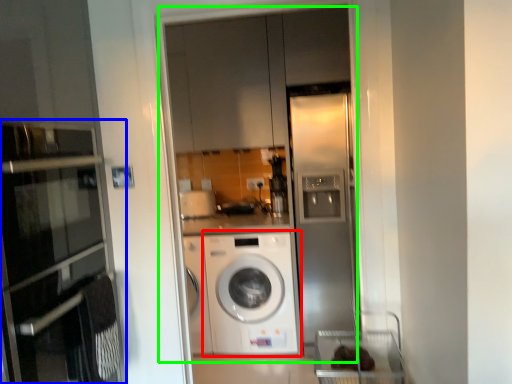
Question: Which is farther away from washing machine (highlighted by a red box)? oven (highlighted by a blue box) or glass door (highlighted by a green box)?

Choices:
 (A) oven
 (B) glass door

Answer: (A)